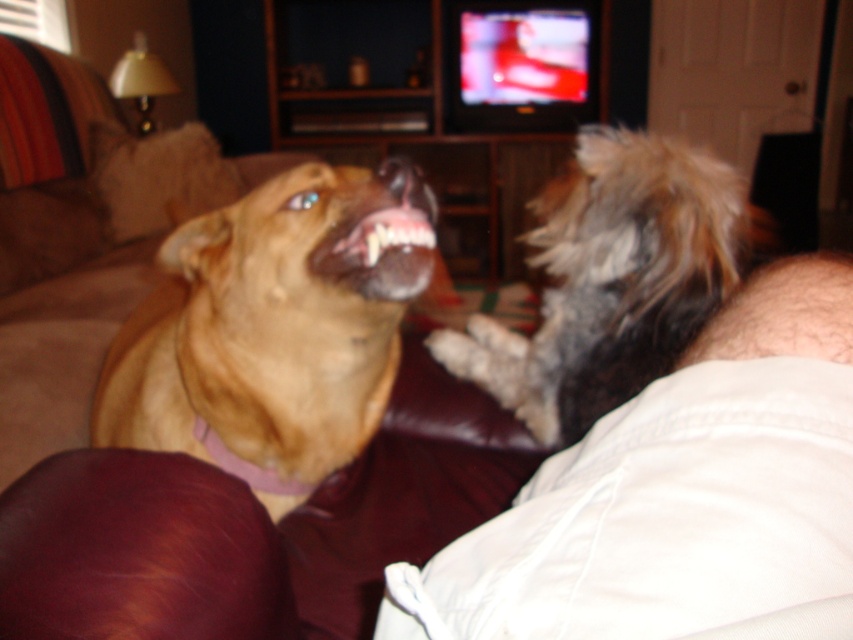
Does point (502, 522) lie in front of point (646, 362)?

Yes, point (502, 522) is in front of point (646, 362).

Which of these two, white cotton leg at lower right or fuzzy brown dog at right, stands taller?

fuzzy brown dog at right is taller.

Which is behind, point (456, 547) or point (722, 173)?

Point (722, 173)

Where is `white cotton leg at lower right`? The height and width of the screenshot is (640, 853). white cotton leg at lower right is located at coordinates (680, 496).

Locate an element on the screen. The image size is (853, 640). white cotton leg at lower right is located at coordinates (680, 496).

Does point (732, 540) lie behind point (238, 307)?

No, (732, 540) is closer to viewer.

At what (x,y) coordinates should I click in order to perform the action: click on white cotton leg at lower right. Please return your answer as a coordinate pair (x, y). This screenshot has width=853, height=640. Looking at the image, I should click on (680, 496).

Who is more forward, [345,234] or [364,250]?

Point [364,250] is more forward.

Between matte brown dog at left and matte brown teeth at center, which one appears on the left side from the viewer's perspective?

From the viewer's perspective, matte brown dog at left appears more on the left side.

This screenshot has width=853, height=640. Describe the element at coordinates (274, 328) in the screenshot. I see `matte brown dog at left` at that location.

Where is `matte brown dog at left`? This screenshot has height=640, width=853. matte brown dog at left is located at coordinates (274, 328).